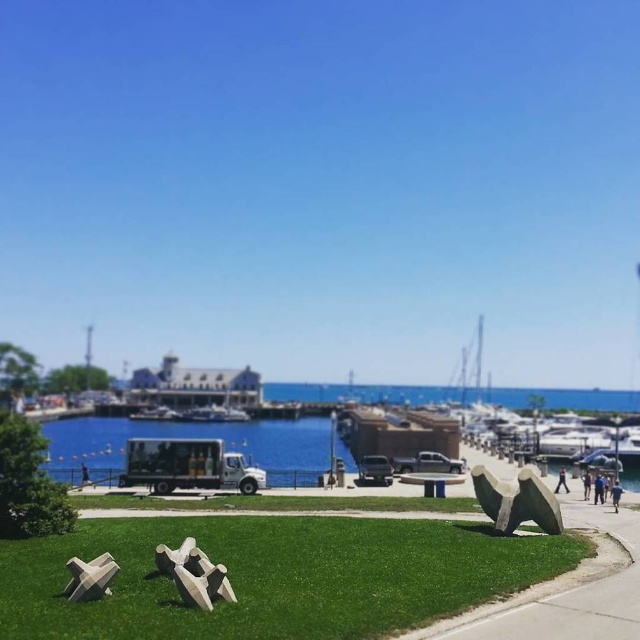
Question: Which point appears farthest from the camera in this image?

Choices:
 (A) (561, 484)
 (B) (445, 605)

Answer: (A)

Question: Which of the following is the farthest from the observer?

Choices:
 (A) dark blue jeans at center
 (B) blue fabric person at lower right

Answer: (A)

Question: Estimate the real-world distances between objects in this image. Which object is farther from the gray concrete sculpture at center?

Choices:
 (A) green grass at lower center
 (B) dark blue jeans at center
 (C) blue water at center
 (D) blue fabric person at lower right

Answer: (C)

Question: Does green grass at lower center lie in front of blue water at center?

Choices:
 (A) yes
 (B) no

Answer: (A)

Question: Does green grass at lower center have a lesser width compared to blue water at center?

Choices:
 (A) no
 (B) yes

Answer: (B)

Question: Does dark blue jeans at center appear on the left side of blue fabric person at lower right?

Choices:
 (A) no
 (B) yes

Answer: (A)